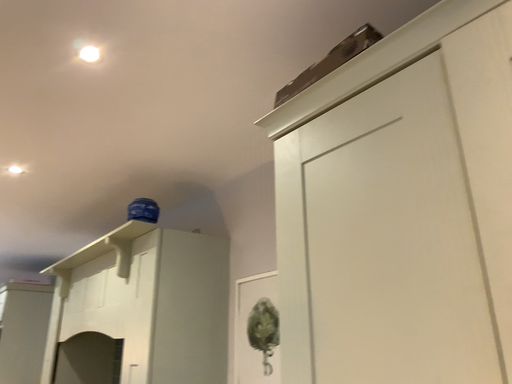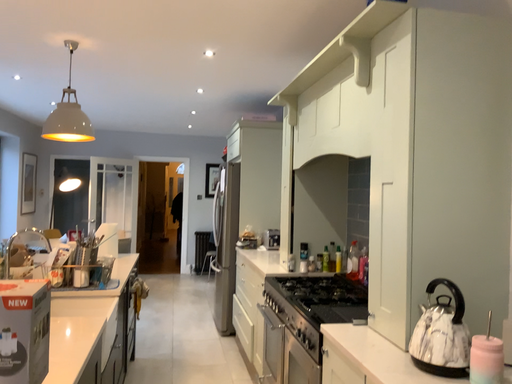
Question: How did the camera likely rotate when shooting the video?

Choices:
 (A) rotated downward
 (B) rotated upward

Answer: (A)